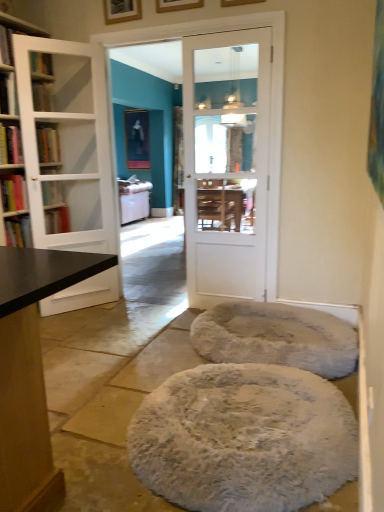
What do you see at coordinates (8, 94) in the screenshot?
I see `hardcover book at left, positioned as the 4th book in bottom-to-top order` at bounding box center [8, 94].

Measure the distance between point (x=97, y=168) and camera.

The distance of point (x=97, y=168) from camera is 3.42 meters.

This screenshot has height=512, width=384. What do you see at coordinates (14, 193) in the screenshot?
I see `hardcover book at left, the 2th book in the bottom-to-top sequence` at bounding box center [14, 193].

This screenshot has width=384, height=512. I want to click on hardcover book at left, which is the 2th book from top to bottom, so click(x=10, y=145).

This screenshot has height=512, width=384. I want to click on white glossy door at center, positioned as the first door in right-to-left order, so tap(226, 164).

Who is more distant, white glass shelf at upper left or white fluffy cat bed at center?

white glass shelf at upper left is further away from the camera.

What's the angular difference between white glass shelf at upper left and white fluffy cat bed at center's facing directions?

They differ by 177 degrees in their facing directions.

Can white fluffy cat bed at center be found inside white glass shelf at upper left?

No, white fluffy cat bed at center is not surrounded by white glass shelf at upper left.

From the image's perspective, which object appears higher, white glass shelf at upper left or white fluffy cat bed at center?

white glass shelf at upper left.

Which point is more forward, (x=1, y=22) or (x=72, y=485)?

The point (x=72, y=485) is in front.

Is white fluffy pouf at center completely or partially inside white glass shelf at upper left?

No, white fluffy pouf at center is not a part of white glass shelf at upper left.

Is white glass shelf at upper left positioned with its back to white fluffy pouf at center?

That's not correct — white glass shelf at upper left is not looking away from white fluffy pouf at center.

How far apart are white glass shelf at upper left and white fluffy pouf at center?

They are 2.14 meters apart.

From the image's perspective, which one is positioned higher, white glossy door at center, which ranks as the second door in left-to-right order, or hardcover book at left, arranged as the third book when ordered from the bottom?

hardcover book at left, arranged as the third book when ordered from the bottom, appears higher in the image.

Between white glossy door at center, positioned as the first door in right-to-left order, and hardcover book at left, which is the 2th book from top to bottom, which one has smaller width?

white glossy door at center, positioned as the first door in right-to-left order.

From a real-world perspective, does white glossy door at center, which ranks as the second door in left-to-right order, stand above hardcover book at left, arranged as the third book when ordered from the bottom?

No.

Considering the sizes of objects hardcover book at left, the 2th book in the bottom-to-top sequence, and matte black picture frame at upper center, the fourth picture frame viewed from the front, in the image provided, who is shorter, hardcover book at left, the 2th book in the bottom-to-top sequence, or matte black picture frame at upper center, the fourth picture frame viewed from the front,?

With less height is hardcover book at left, the 2th book in the bottom-to-top sequence.

From the picture: From a real-world perspective, is hardcover book at left, the 2th book in the bottom-to-top sequence, on top of matte black picture frame at upper center, which is the 1th picture frame in back-to-front order?

Incorrect, from a real-world perspective, hardcover book at left, the 2th book in the bottom-to-top sequence, is lower than matte black picture frame at upper center, which is the 1th picture frame in back-to-front order.

From the image's perspective, is hardcover book at left, the 2th book in the bottom-to-top sequence, beneath matte black picture frame at upper center, the fourth picture frame viewed from the front?

Indeed, from the image's perspective, hardcover book at left, the 2th book in the bottom-to-top sequence, is shown beneath matte black picture frame at upper center, the fourth picture frame viewed from the front.

Find the location of `the 1st picture frame located above the hardcover book at left, the 2th book in the bottom-to-top sequence (from a real-world perspective)`. the 1st picture frame located above the hardcover book at left, the 2th book in the bottom-to-top sequence (from a real-world perspective) is located at coordinates (137, 139).

From the picture: Considering the relative sizes of white fluffy pouf at center and hardcover book at left, the third book from the top, in the image provided, is white fluffy pouf at center shorter than hardcover book at left, the third book from the top,?

Correct, white fluffy pouf at center is not as tall as hardcover book at left, the third book from the top.

Which is behind, point (99, 482) or point (25, 189)?

The point (25, 189) is more distant.

Considering the sizes of objects white fluffy pouf at center and hardcover book at left, the 2th book in the bottom-to-top sequence, in the image provided, who is wider, white fluffy pouf at center or hardcover book at left, the 2th book in the bottom-to-top sequence,?

Wider between the two is white fluffy pouf at center.

Would you say white fluffy pouf at center is inside or outside hardcover book at left, the third book from the top?

The correct answer is: outside.

Between wooden picture frame at upper center, placed as the 3th picture frame when sorted from back to front, and white glass door at left, which is counted as the second door, starting from the right, which one has more height?

white glass door at left, which is counted as the second door, starting from the right, is taller.

Is there a large distance between wooden picture frame at upper center, arranged as the 2th picture frame when viewed from the front, and white glass door at left, the 1th door in the left-to-right sequence?

Indeed, wooden picture frame at upper center, arranged as the 2th picture frame when viewed from the front, is not near white glass door at left, the 1th door in the left-to-right sequence.

Would you say wooden picture frame at upper center, which ranks as the 3th picture frame in left-to-right order, is inside or outside white glass door at left, which is counted as the second door, starting from the right?

wooden picture frame at upper center, which ranks as the 3th picture frame in left-to-right order, exists outside the volume of white glass door at left, which is counted as the second door, starting from the right.

Relative to white glass door at left, the 1th door in the left-to-right sequence, is wooden picture frame at upper center, placed as the 3th picture frame when sorted from back to front, in front or behind?

Clearly, wooden picture frame at upper center, placed as the 3th picture frame when sorted from back to front, is in front of white glass door at left, the 1th door in the left-to-right sequence.

In the image, is white glass door at left, the 1th door in the left-to-right sequence, positioned in front of or behind white glass shelf at upper left?

In the image, white glass door at left, the 1th door in the left-to-right sequence, appears behind white glass shelf at upper left.

From the image's perspective, which one is positioned higher, white glass door at left, the 1th door in the left-to-right sequence, or white glass shelf at upper left?

white glass shelf at upper left.

Based on the photo, how far apart are white glass door at left, which is counted as the second door, starting from the right, and white glass shelf at upper left?

A distance of 63.85 centimeters exists between white glass door at left, which is counted as the second door, starting from the right, and white glass shelf at upper left.

Identify the location of shelf located on the left of white glass door at left, which is counted as the second door, starting from the right. The width and height of the screenshot is (384, 512). (14, 32).

At what (x,y) coordinates should I click in order to perform the action: click on cat bed below the white glass shelf at upper left (from a real-world perspective). Please return your answer as a coordinate pair (x, y). This screenshot has width=384, height=512. Looking at the image, I should click on (276, 337).

The width and height of the screenshot is (384, 512). What are the coordinates of `concrete in front of the white glass shelf at upper left` in the screenshot? It's located at (107, 399).

From the image, which object appears to be nearer to white glass shelf at upper left, black matte bookshelf at left, placed as the 1th book when sorted from bottom to top, or wooden picture frame at upper center, the 4th picture frame from the left?

black matte bookshelf at left, placed as the 1th book when sorted from bottom to top.

In the scene shown: Based on their spatial positions, is hardcover book at left, the 2th book in the bottom-to-top sequence, or white glass shelf at upper left further from wooden picture frame at upper center, which is counted as the 1th picture frame, starting from the right?

hardcover book at left, the 2th book in the bottom-to-top sequence, is further to wooden picture frame at upper center, which is counted as the 1th picture frame, starting from the right.

Which object lies further to the anchor point wooden picture frame at upper center, the 1th picture frame positioned from the front, wooden picture frame at upper center, acting as the 2th picture frame starting from the back, or white glass shelf at upper left?

white glass shelf at upper left is further to wooden picture frame at upper center, the 1th picture frame positioned from the front.

Based on their spatial positions, is hardcover book at left, the third book from the top, or hardcover book at left, arranged as the third book when ordered from the bottom, closer to white glossy door at center, which ranks as the second door in left-to-right order?

hardcover book at left, arranged as the third book when ordered from the bottom.

Looking at the image, which one is located further to white fluffy pouf at center, hardcover book at left, which is the 2th book from top to bottom, or wooden picture frame at upper center, the second picture frame when ordered from right to left?

wooden picture frame at upper center, the second picture frame when ordered from right to left, is positioned further to the anchor white fluffy pouf at center.

When comparing their distances from wooden picture frame at upper center, the second picture frame when ordered from right to left, does black matte bookshelf at left, which is the fourth book from top to bottom, or white glass door at left, the 1th door in the left-to-right sequence, seem closer?

Among the two, white glass door at left, the 1th door in the left-to-right sequence, is located nearer to wooden picture frame at upper center, the second picture frame when ordered from right to left.

Estimate the real-world distances between objects in this image. Which object is further from white glass door at left, the 1th door in the left-to-right sequence, white glossy door at center, which ranks as the second door in left-to-right order, or wooden picture frame at upper center, marked as the 3th picture frame in a right-to-left arrangement?

white glossy door at center, which ranks as the second door in left-to-right order.

Considering their positions, is black matte bookshelf at left, which is the fourth book from top to bottom, positioned further to hardcover book at left, the 2th book in the bottom-to-top sequence, than matte black picture frame at upper center, which appears as the 1th picture frame when viewed from the left?

Among the two, matte black picture frame at upper center, which appears as the 1th picture frame when viewed from the left, is located further to hardcover book at left, the 2th book in the bottom-to-top sequence.

You are a GUI agent. You are given a task and a screenshot of the screen. Output one action in this format:
    pyautogui.click(x=<x>, y=<y>)
    Task: Click on the shelf between white glossy door at center, which ranks as the second door in left-to-right order, and matte black picture frame at upper center, which is the 1th picture frame in back-to-front order, in the front-back direction
    This screenshot has height=512, width=384.
    Given the screenshot: What is the action you would take?
    pyautogui.click(x=14, y=32)

The height and width of the screenshot is (512, 384). I want to click on picture frame between hardcover book at left, which is the 2th book from top to bottom, and matte black picture frame at upper center, which is the 1th picture frame in back-to-front order, from front to back, so click(122, 11).

The height and width of the screenshot is (512, 384). What are the coordinates of `picture frame between wooden picture frame at upper center, arranged as the 2th picture frame when viewed from the front, and white fluffy pouf at center vertically` in the screenshot? It's located at (238, 2).

Identify the location of book between wooden picture frame at upper center, acting as the 2th picture frame starting from the back, and matte black picture frame at upper center, the fourth picture frame viewed from the front, in the front-back direction. (19, 232).